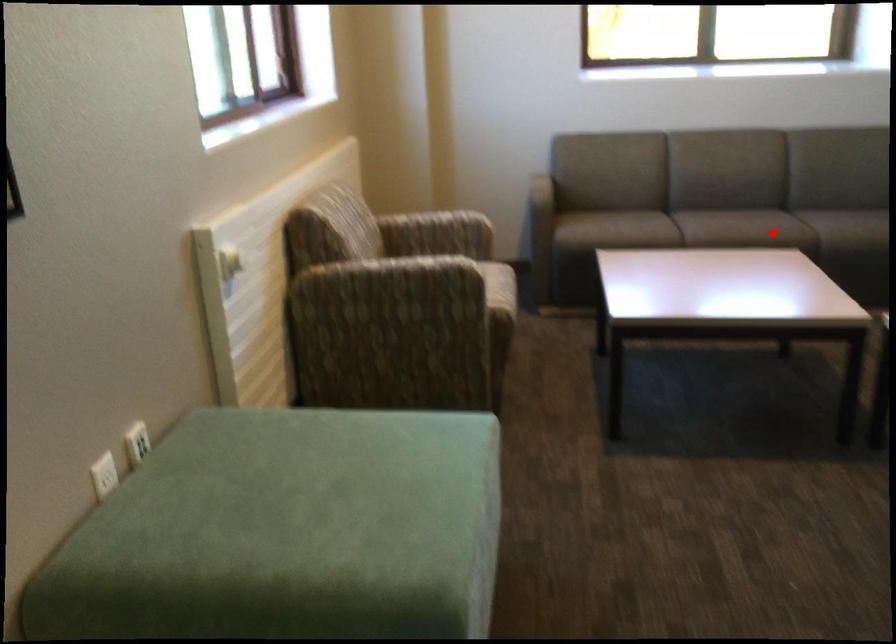
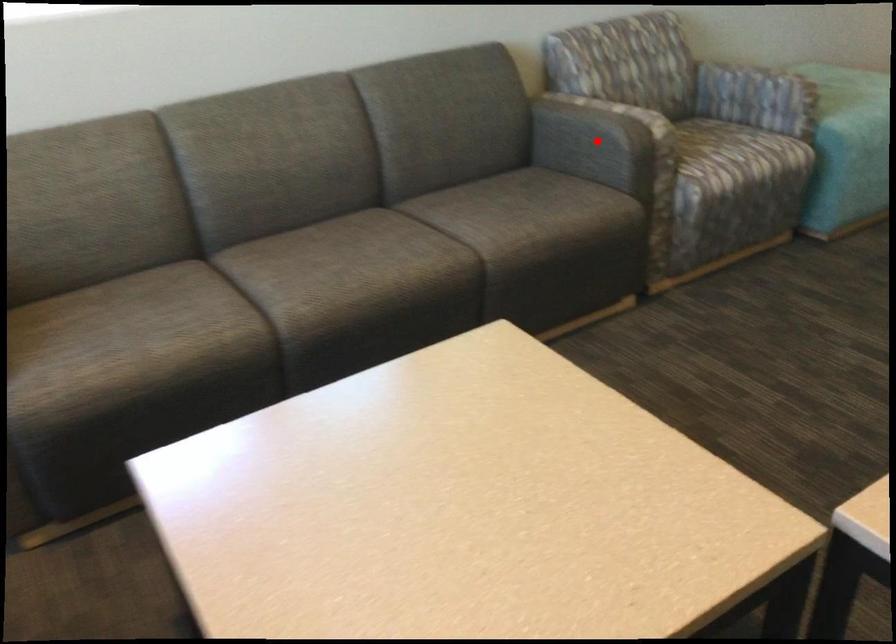
I am providing you with two images of the same scene from different viewpoints. A red point is marked on the first image and another point is marked on the second image. Does the point marked in image1 correspond to the same location as the one in image2?

No